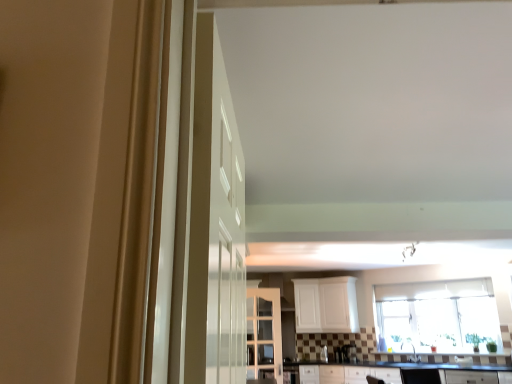
Question: From a real-world perspective, is clear glass window at center physically below white glossy door at center?

Choices:
 (A) yes
 (B) no

Answer: (A)

Question: Can you confirm if clear glass window at center is bigger than white glossy door at center?

Choices:
 (A) yes
 (B) no

Answer: (A)

Question: Is the position of clear glass window at center more distant than that of white glossy door at center?

Choices:
 (A) no
 (B) yes

Answer: (B)

Question: Is clear glass window at center located outside white glossy door at center?

Choices:
 (A) no
 (B) yes

Answer: (B)

Question: Is clear glass window at center positioned with its back to white glossy door at center?

Choices:
 (A) no
 (B) yes

Answer: (A)

Question: Is clear glass window at center to the right of white glossy door at center from the viewer's perspective?

Choices:
 (A) yes
 (B) no

Answer: (A)

Question: Is white glossy door at center at the left side of black laminate countertop at lower center?

Choices:
 (A) yes
 (B) no

Answer: (A)

Question: Is the position of white glossy door at center more distant than that of black laminate countertop at lower center?

Choices:
 (A) no
 (B) yes

Answer: (A)

Question: Is white glossy door at center bigger than black laminate countertop at lower center?

Choices:
 (A) yes
 (B) no

Answer: (B)

Question: From the image's perspective, is white glossy door at center beneath black laminate countertop at lower center?

Choices:
 (A) yes
 (B) no

Answer: (B)

Question: Can you confirm if white glossy door at center is smaller than black laminate countertop at lower center?

Choices:
 (A) yes
 (B) no

Answer: (A)

Question: Is white glossy door at center oriented towards black laminate countertop at lower center?

Choices:
 (A) yes
 (B) no

Answer: (B)

Question: From a real-world perspective, is white glossy sink at center physically below clear glass window at center?

Choices:
 (A) yes
 (B) no

Answer: (A)